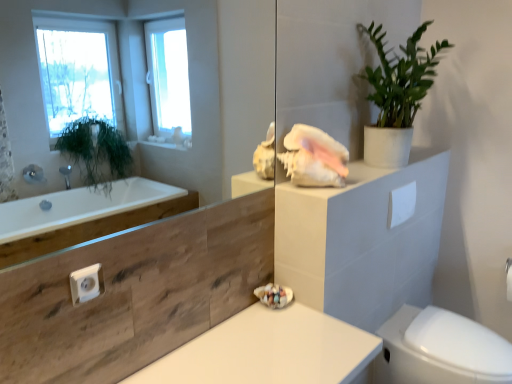
Where is `free space above white matte countertop at center (from a real-world perspective)`? Image resolution: width=512 pixels, height=384 pixels. free space above white matte countertop at center (from a real-world perspective) is located at coordinates (253, 359).